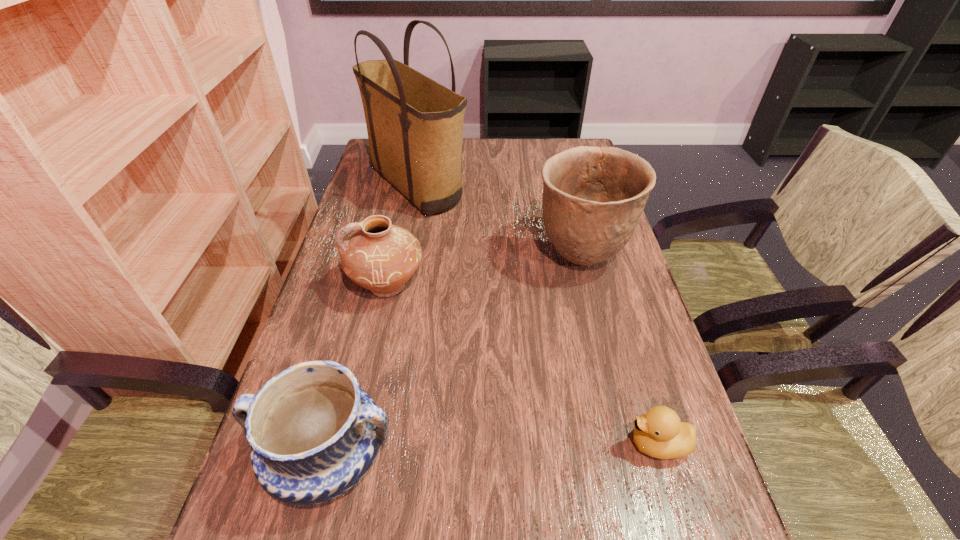
Image resolution: width=960 pixels, height=540 pixels. What are the coordinates of `vacant region located 0.260m on the face of the shortest object` in the screenshot? It's located at (481, 444).

At what (x,y) coordinates should I click in order to perform the action: click on free point located 0.100m on the face of the shortest object. Please return your answer as a coordinate pair (x, y). Image resolution: width=960 pixels, height=540 pixels. Looking at the image, I should click on (570, 444).

Locate an element on the screen. object that is at the far edge is located at coordinates (415, 125).

The image size is (960, 540). I want to click on tote bag located in the left edge section of the desktop, so click(415, 125).

At what (x,y) coordinates should I click in order to perform the action: click on pottery located in the right edge section of the desktop. Please return your answer as a coordinate pair (x, y). Looking at the image, I should click on (593, 197).

In order to click on duckling situated at the right edge in this screenshot , I will do `click(659, 433)`.

Image resolution: width=960 pixels, height=540 pixels. Find the location of `object present at the far left corner`. object present at the far left corner is located at coordinates (415, 125).

Identify the location of free spot at the far edge of the desktop. (539, 147).

The width and height of the screenshot is (960, 540). Identify the location of vacant space at the right edge of the desktop. (650, 361).

Locate an element on the screen. This screenshot has height=540, width=960. vacant point located between the duckling and the fourth shortest object is located at coordinates (619, 351).